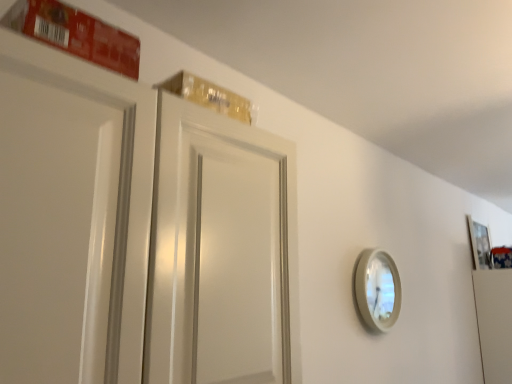
What do you see at coordinates (479, 244) in the screenshot?
I see `wooden picture frame at upper right` at bounding box center [479, 244].

Locate an element on the screen. wooden picture frame at upper right is located at coordinates (479, 244).

What is the approximate width of white glossy mirror at right?

2.44 inches.

The height and width of the screenshot is (384, 512). Describe the element at coordinates (377, 289) in the screenshot. I see `white glossy mirror at right` at that location.

What are the coordinates of `white glossy mirror at right` in the screenshot? It's located at (377, 289).

Locate an element on the screen. This screenshot has height=384, width=512. wooden picture frame at upper right is located at coordinates (479, 244).

Which object is positioned more to the right, wooden picture frame at upper right or white glossy mirror at right?

From the viewer's perspective, wooden picture frame at upper right appears more on the right side.

Which is in front, wooden picture frame at upper right or white glossy mirror at right?

white glossy mirror at right is closer to the camera.

Is point (475, 228) closer or farther from the camera than point (361, 293)?

Point (475, 228) is farther from the camera than point (361, 293).

From the image's perspective, relative to white glossy mirror at right, is wooden picture frame at upper right above or below?

From the image's perspective, wooden picture frame at upper right appears above white glossy mirror at right.

From a real-world perspective, is wooden picture frame at upper right under white glossy mirror at right?

Incorrect, from a real-world perspective, wooden picture frame at upper right is higher than white glossy mirror at right.

Which of these two, wooden picture frame at upper right or white glossy mirror at right, is thinner?

Thinner between the two is wooden picture frame at upper right.

From the picture: Between wooden picture frame at upper right and white glossy mirror at right, which one has more height?

Standing taller between the two is wooden picture frame at upper right.

Does wooden picture frame at upper right have a smaller size compared to white glossy mirror at right?

Actually, wooden picture frame at upper right might be larger than white glossy mirror at right.

In the scene shown: Is wooden picture frame at upper right inside or outside of white glossy mirror at right?

wooden picture frame at upper right is spatially situated outside white glossy mirror at right.

Is wooden picture frame at upper right placed right next to white glossy mirror at right?

No.

Is wooden picture frame at upper right oriented towards white glossy mirror at right?

No, wooden picture frame at upper right is not turned towards white glossy mirror at right.

How many degrees apart are the facing directions of wooden picture frame at upper right and white glossy mirror at right?

0.833 degrees.

Measure the distance between wooden picture frame at upper right and white glossy mirror at right.

wooden picture frame at upper right is 1.37 meters away from white glossy mirror at right.

Locate an element on the screen. The width and height of the screenshot is (512, 384). mirror below the wooden picture frame at upper right (from the image's perspective) is located at coordinates (377, 289).

Based on the photo, considering the relative positions of white glossy mirror at right and wooden picture frame at upper right in the image provided, is white glossy mirror at right to the left or to the right of wooden picture frame at upper right?

white glossy mirror at right is to the left of wooden picture frame at upper right.

Is the position of white glossy mirror at right less distant than that of wooden picture frame at upper right?

Yes, the depth of white glossy mirror at right is less than that of wooden picture frame at upper right.

Does point (382, 252) lie behind point (488, 254)?

No, (382, 252) is closer to viewer.

From the image's perspective, which one is positioned higher, white glossy mirror at right or wooden picture frame at upper right?

wooden picture frame at upper right appears higher in the image.

From a real-world perspective, who is located lower, white glossy mirror at right or wooden picture frame at upper right?

In real-world perspective, white glossy mirror at right is lower.

Looking at their sizes, would you say white glossy mirror at right is wider or thinner than wooden picture frame at upper right?

In the image, white glossy mirror at right appears to be wider than wooden picture frame at upper right.

In terms of height, does white glossy mirror at right look taller or shorter compared to wooden picture frame at upper right?

In the image, white glossy mirror at right appears to be shorter than wooden picture frame at upper right.

Considering the sizes of objects white glossy mirror at right and wooden picture frame at upper right in the image provided, who is bigger, white glossy mirror at right or wooden picture frame at upper right?

wooden picture frame at upper right is bigger.

Could wooden picture frame at upper right be considered to be inside white glossy mirror at right?

No, white glossy mirror at right does not contain wooden picture frame at upper right.

Are white glossy mirror at right and wooden picture frame at upper right far apart?

Indeed, white glossy mirror at right is not near wooden picture frame at upper right.

Does white glossy mirror at right turn towards wooden picture frame at upper right?

No, white glossy mirror at right is not oriented towards wooden picture frame at upper right.

At what (x,y) coordinates should I click in order to perform the action: click on mirror on the left of wooden picture frame at upper right. Please return your answer as a coordinate pair (x, y). The image size is (512, 384). Looking at the image, I should click on (377, 289).

In order to click on picture frame located above the white glossy mirror at right (from the image's perspective) in this screenshot , I will do `click(479, 244)`.

Locate an element on the screen. The image size is (512, 384). picture frame behind the white glossy mirror at right is located at coordinates (479, 244).